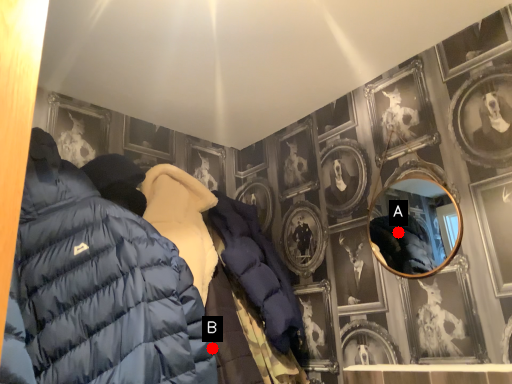
Question: Two points are circled on the image, labeled by A and B beside each circle. Which point is further to the camera?

Choices:
 (A) A is further
 (B) B is further

Answer: (A)